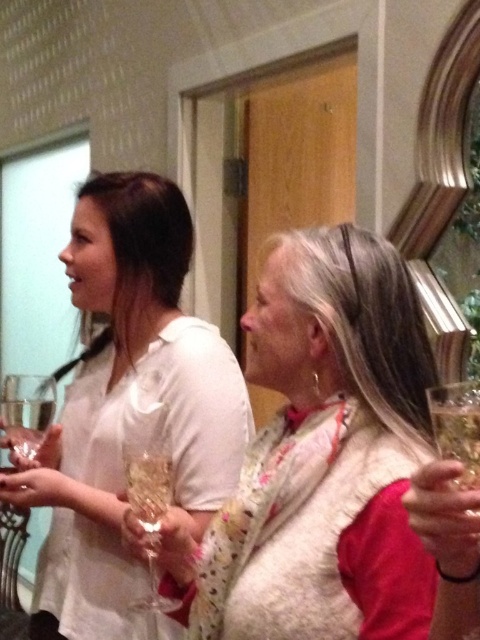
Between white matte shirt at center and clear glass wine glass at lower right, which one appears on the left side from the viewer's perspective?

white matte shirt at center

Is point (187, 364) less distant than point (470, 467)?

No, (187, 364) is behind (470, 467).

What are the coordinates of `white matte shirt at center` in the screenshot? It's located at (130, 408).

Who is shorter, white matte shirt at center or clear glass wine glass at center?

Standing shorter between the two is clear glass wine glass at center.

How much distance is there between white matte shirt at center and clear glass wine glass at center?

They are 7.61 inches apart.

I want to click on white matte shirt at center, so click(130, 408).

Is white textured scarf at center wider than clear glass wine glass at center?

Yes.

Is point (211, 602) more distant than point (147, 504)?

Yes, it is.

Locate an element on the screen. The image size is (480, 640). white textured scarf at center is located at coordinates (322, 458).